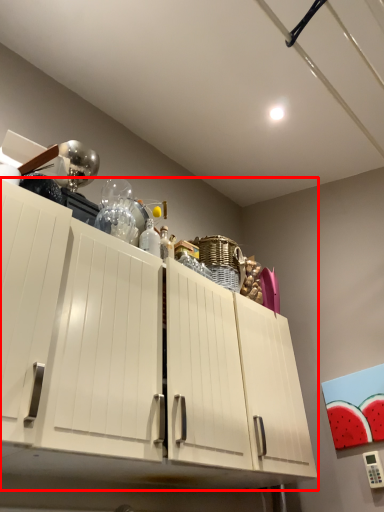
Question: From the image's perspective, where is cabinetry (annotated by the red box) located in relation to bottle in the image?

Choices:
 (A) above
 (B) below

Answer: (B)